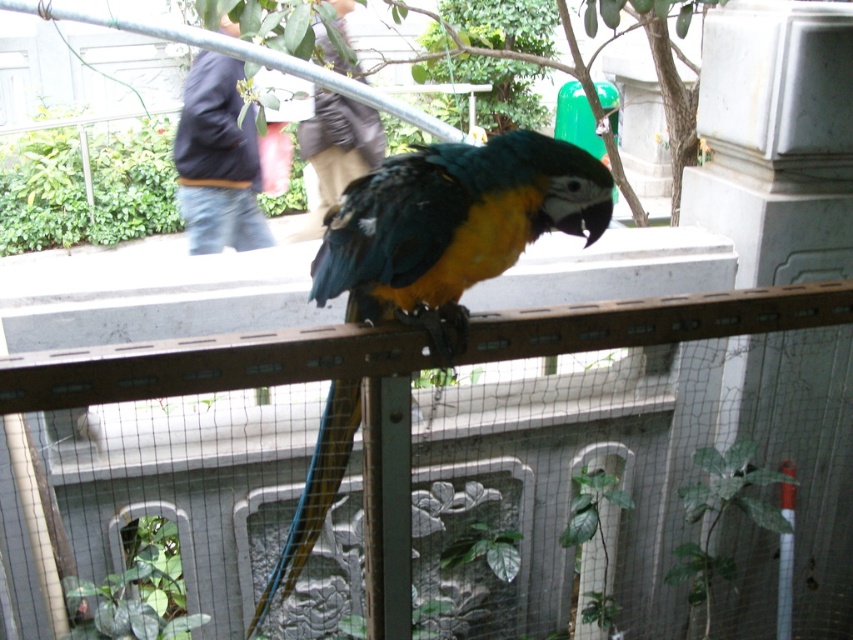
Question: Which object is farther from the camera taking this photo?

Choices:
 (A) shiny multicolored parrot at center
 (B) metal mesh fence at center

Answer: (A)

Question: Which point is farther to the camera?

Choices:
 (A) metal mesh fence at center
 (B) shiny multicolored parrot at center

Answer: (B)

Question: Observing the image, what is the correct spatial positioning of metal mesh fence at center in reference to shiny multicolored parrot at center?

Choices:
 (A) right
 (B) left

Answer: (A)

Question: Is metal mesh fence at center thinner than shiny multicolored parrot at center?

Choices:
 (A) no
 (B) yes

Answer: (A)

Question: Is metal mesh fence at center smaller than shiny multicolored parrot at center?

Choices:
 (A) yes
 (B) no

Answer: (A)